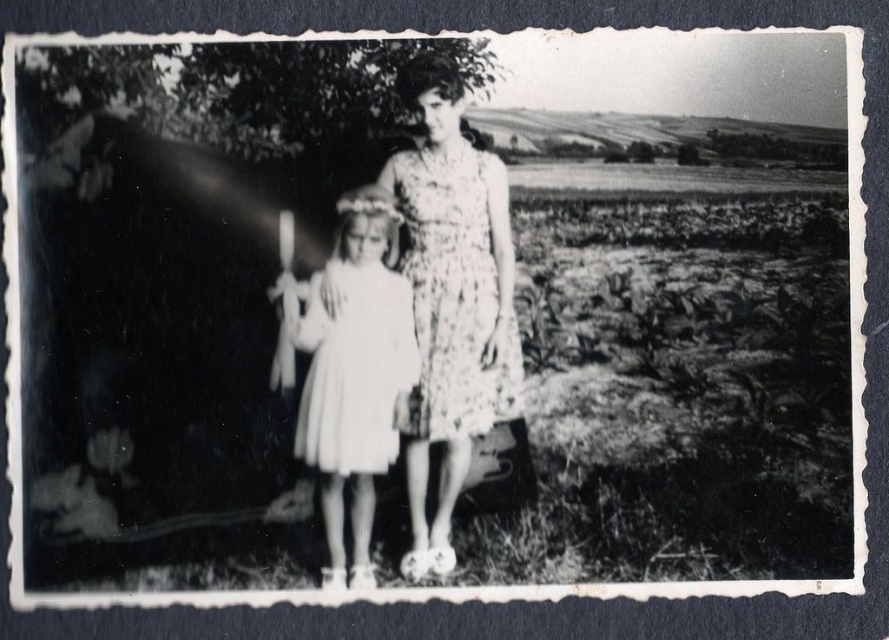
Who is taller, floral-patterned dress at center or white satin dress at center?

floral-patterned dress at center is taller.

Is point (447, 227) positioned after point (354, 529)?

Yes, it is.

Between point (411, 257) and point (398, 349), which one is positioned in front?

Positioned in front is point (411, 257).

Find the location of `floral-patterned dress at center`. floral-patterned dress at center is located at coordinates (451, 300).

Is white satin dress at center further to camera compared to floral-patterned fabric dress at center?

That is False.

Is point (359, 550) in front of point (458, 196)?

Yes.

The height and width of the screenshot is (640, 889). Find the location of `white satin dress at center`. white satin dress at center is located at coordinates (350, 372).

Is floral-patterned dress at center to the left of floral-patterned fabric dress at center from the viewer's perspective?

Yes, floral-patterned dress at center is to the left of floral-patterned fabric dress at center.

Can you confirm if floral-patterned dress at center is positioned above floral-patterned fabric dress at center?

No, floral-patterned dress at center is not above floral-patterned fabric dress at center.

Which is in front, point (455, 74) or point (402, 195)?

Point (455, 74) is more forward.

You are a GUI agent. You are given a task and a screenshot of the screen. Output one action in this format:
    pyautogui.click(x=<x>, y=<y>)
    Task: Click on the floral-patterned dress at center
    
    Given the screenshot: What is the action you would take?
    pyautogui.click(x=451, y=300)